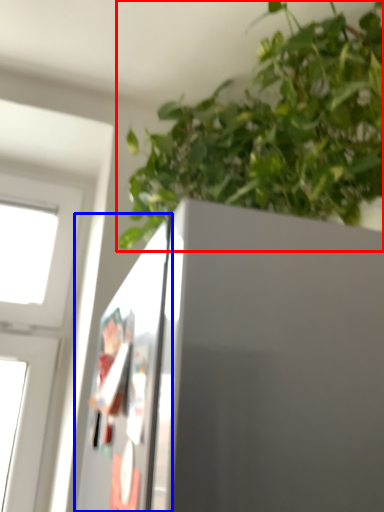
Question: Which point is closer to the camera, houseplant (highlighted by a red box) or screen door (highlighted by a blue box)?

Choices:
 (A) houseplant
 (B) screen door

Answer: (B)